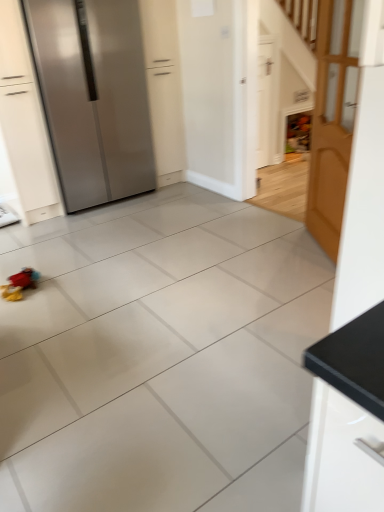
Question: Does wooden door at right, the 1th door viewed from the front, have a greater width compared to plush multicolored toy at lower left?

Choices:
 (A) yes
 (B) no

Answer: (B)

Question: Can you confirm if wooden door at right, the 1th door viewed from the front, is shorter than plush multicolored toy at lower left?

Choices:
 (A) no
 (B) yes

Answer: (A)

Question: Can you confirm if wooden door at right, the second door in the back-to-front sequence, is thinner than plush multicolored toy at lower left?

Choices:
 (A) yes
 (B) no

Answer: (A)

Question: Is wooden door at right, the second door in the back-to-front sequence, not within plush multicolored toy at lower left?

Choices:
 (A) no
 (B) yes

Answer: (B)

Question: Could you tell me if wooden door at right, the second door in the back-to-front sequence, is facing plush multicolored toy at lower left?

Choices:
 (A) yes
 (B) no

Answer: (A)

Question: Is wooden door at right, the 1th door viewed from the front, further to the viewer compared to plush multicolored toy at lower left?

Choices:
 (A) yes
 (B) no

Answer: (B)

Question: From a real-world perspective, does white matte door at upper right, which appears as the 1th door when viewed from the back, stand above plush multicolored toy at lower left?

Choices:
 (A) no
 (B) yes

Answer: (B)

Question: From the image's perspective, is white matte door at upper right, which is the second door in front-to-back order, beneath plush multicolored toy at lower left?

Choices:
 (A) yes
 (B) no

Answer: (B)

Question: Is white matte door at upper right, which is the second door in front-to-back order, wider than plush multicolored toy at lower left?

Choices:
 (A) yes
 (B) no

Answer: (B)

Question: Is the position of white matte door at upper right, which appears as the 1th door when viewed from the back, less distant than that of plush multicolored toy at lower left?

Choices:
 (A) yes
 (B) no

Answer: (B)

Question: Is white matte door at upper right, which is the second door in front-to-back order, further to camera compared to plush multicolored toy at lower left?

Choices:
 (A) yes
 (B) no

Answer: (A)

Question: Considering the relative positions of white matte door at upper right, which is the second door in front-to-back order, and plush multicolored toy at lower left in the image provided, is white matte door at upper right, which is the second door in front-to-back order, to the left of plush multicolored toy at lower left from the viewer's perspective?

Choices:
 (A) yes
 (B) no

Answer: (B)

Question: Is white matte door at upper right, which appears as the 1th door when viewed from the back, at the left side of wooden door at right, the second door in the back-to-front sequence?

Choices:
 (A) yes
 (B) no

Answer: (A)